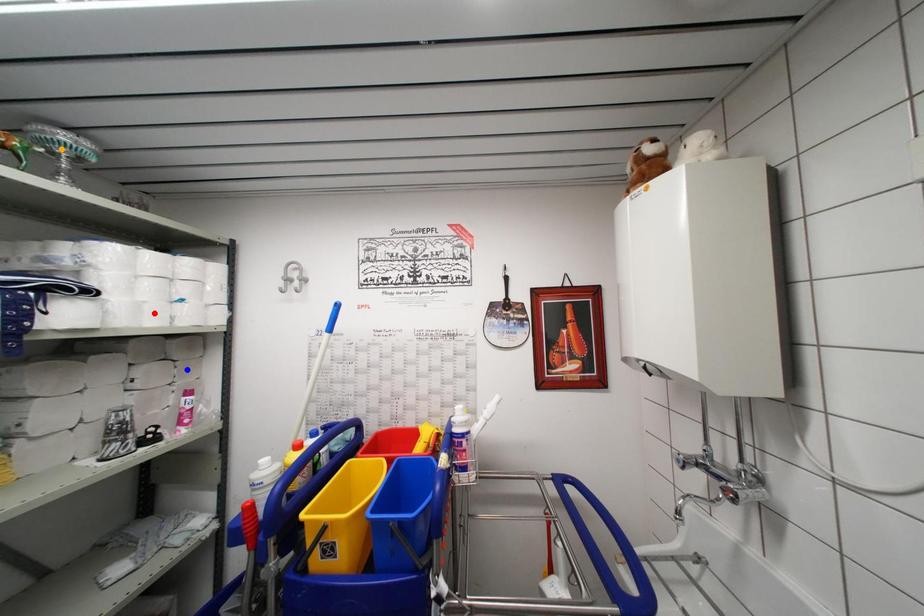
Order these from nearest to farthest:
A) orange point
B) red point
C) blue point

1. orange point
2. red point
3. blue point